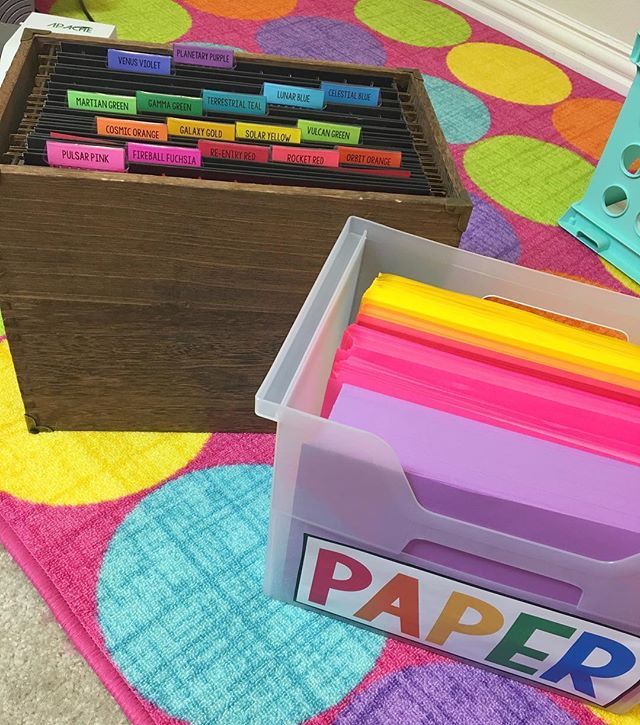
Where is `colorful rug`? colorful rug is located at coordinates (68, 526).